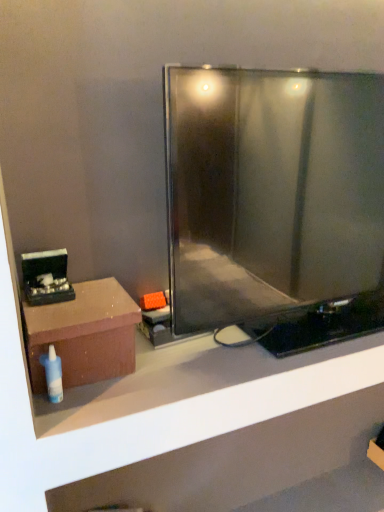
Identify the location of metallic flat-screen tv at center. Image resolution: width=384 pixels, height=512 pixels. (271, 191).

The width and height of the screenshot is (384, 512). Describe the element at coordinates (46, 277) in the screenshot. I see `black glossy jewelry box at left` at that location.

Locate an element on the screen. metallic flat-screen tv at center is located at coordinates (271, 191).

Does point (331, 134) appear closer or farther from the camera than point (235, 500)?

Clearly, point (331, 134) is closer to the camera than point (235, 500).

Would you say metallic flat-screen tv at center contains brown matte shelf at lower left?

That's incorrect, brown matte shelf at lower left is not inside metallic flat-screen tv at center.

From a real-world perspective, is metallic flat-screen tv at center physically located above or below brown matte shelf at lower left?

From a real-world perspective, metallic flat-screen tv at center is physically above brown matte shelf at lower left.

Which of these two, white plastic bottle at lower left or black glossy jewelry box at left, is thinner?

With smaller width is white plastic bottle at lower left.

Consider the image. From their relative heights in the image, would you say white plastic bottle at lower left is taller or shorter than black glossy jewelry box at left?

Considering their sizes, white plastic bottle at lower left has more height than black glossy jewelry box at left.

Is white plastic bottle at lower left positioned with its back to black glossy jewelry box at left?

No, white plastic bottle at lower left is not facing the opposite direction of black glossy jewelry box at left.

Is brown matte shelf at lower left smaller than matte brown box at left?

No, brown matte shelf at lower left is not smaller than matte brown box at left.

From a real-world perspective, is brown matte shelf at lower left under matte brown box at left?

Yes, from a real-world perspective, brown matte shelf at lower left is under matte brown box at left.

Is brown matte shelf at lower left not within matte brown box at left?

brown matte shelf at lower left is positioned outside matte brown box at left.

Considering the relative sizes of brown matte shelf at lower left and black glossy jewelry box at left in the image provided, is brown matte shelf at lower left bigger than black glossy jewelry box at left?

Indeed, brown matte shelf at lower left has a larger size compared to black glossy jewelry box at left.

Is brown matte shelf at lower left surrounding black glossy jewelry box at left?

That's incorrect, black glossy jewelry box at left is not inside brown matte shelf at lower left.

Does brown matte shelf at lower left have a greater width compared to black glossy jewelry box at left?

Indeed, brown matte shelf at lower left has a greater width compared to black glossy jewelry box at left.

Based on the photo, which object is more forward, brown matte shelf at lower left or black glossy jewelry box at left?

brown matte shelf at lower left is closer to the camera.

Measure the distance between black glossy jewelry box at left and matte brown box at left.

The distance of black glossy jewelry box at left from matte brown box at left is 8.96 centimeters.

This screenshot has width=384, height=512. Find the location of `appliance on the left of the matte brown box at left`. appliance on the left of the matte brown box at left is located at coordinates (46, 277).

From the image's perspective, would you say black glossy jewelry box at left is positioned over matte brown box at left?

Yes, from the image's perspective, black glossy jewelry box at left is over matte brown box at left.

From a real-world perspective, is black glossy jewelry box at left below matte brown box at left?

No, from a real-world perspective, black glossy jewelry box at left is not under matte brown box at left.

Is metallic flat-screen tv at center next to black glossy jewelry box at left and touching it?

No, metallic flat-screen tv at center is not beside black glossy jewelry box at left.

Based on their sizes in the image, would you say metallic flat-screen tv at center is bigger or smaller than black glossy jewelry box at left?

metallic flat-screen tv at center is bigger than black glossy jewelry box at left.

Considering the positions of objects metallic flat-screen tv at center and black glossy jewelry box at left in the image provided, who is behind, metallic flat-screen tv at center or black glossy jewelry box at left?

Positioned behind is black glossy jewelry box at left.

From a real-world perspective, between metallic flat-screen tv at center and black glossy jewelry box at left, who is vertically higher?

From a 3D spatial view, metallic flat-screen tv at center is above.

Between matte brown box at left and black glossy jewelry box at left, which one is positioned behind?

black glossy jewelry box at left is behind.

Considering the sizes of objects matte brown box at left and black glossy jewelry box at left in the image provided, who is taller, matte brown box at left or black glossy jewelry box at left?

Standing taller between the two is matte brown box at left.

Looking at this image, is matte brown box at left smaller than black glossy jewelry box at left?

No, matte brown box at left is not smaller than black glossy jewelry box at left.

Can you confirm if matte brown box at left is wider than black glossy jewelry box at left?

Correct, the width of matte brown box at left exceeds that of black glossy jewelry box at left.

Where is `shelf below the metallic flat-screen tv at center (from the image's perspective)`? The width and height of the screenshot is (384, 512). shelf below the metallic flat-screen tv at center (from the image's perspective) is located at coordinates (218, 429).

The width and height of the screenshot is (384, 512). What are the coordinates of `appliance above the white plastic bottle at lower left (from a real-world perspective)` in the screenshot? It's located at (46, 277).

Which object lies further to the anchor point metallic flat-screen tv at center, matte brown box at left or brown matte shelf at lower left?

brown matte shelf at lower left lies further to metallic flat-screen tv at center than the other object.

Based on their spatial positions, is white plastic bottle at lower left or brown matte shelf at lower left closer to metallic flat-screen tv at center?

The object closer to metallic flat-screen tv at center is white plastic bottle at lower left.

When comparing their distances from brown matte shelf at lower left, does white plastic bottle at lower left or matte brown box at left seem closer?

matte brown box at left lies closer to brown matte shelf at lower left than the other object.

From the image, which object appears to be nearer to white plastic bottle at lower left, matte brown box at left or metallic flat-screen tv at center?

matte brown box at left.

Considering their positions, is metallic flat-screen tv at center positioned closer to matte brown box at left than brown matte shelf at lower left?

Among the two, metallic flat-screen tv at center is located nearer to matte brown box at left.

From the image, which object appears to be farther from white plastic bottle at lower left, brown matte shelf at lower left or matte brown box at left?

brown matte shelf at lower left.

Looking at the image, which one is located further to brown matte shelf at lower left, black glossy jewelry box at left or metallic flat-screen tv at center?

Based on the image, black glossy jewelry box at left appears to be further to brown matte shelf at lower left.

Which object lies further to the anchor point matte brown box at left, black glossy jewelry box at left or metallic flat-screen tv at center?

The object further to matte brown box at left is metallic flat-screen tv at center.

I want to click on shelf situated between matte brown box at left and metallic flat-screen tv at center from left to right, so click(x=218, y=429).

Identify the location of furniture between black glossy jewelry box at left and white plastic bottle at lower left in the up-down direction. (84, 334).

Identify the location of furniture between white plastic bottle at lower left and brown matte shelf at lower left from left to right. This screenshot has height=512, width=384. (84, 334).

Locate an element on the screen. This screenshot has width=384, height=512. furniture situated between white plastic bottle at lower left and metallic flat-screen tv at center from left to right is located at coordinates (84, 334).